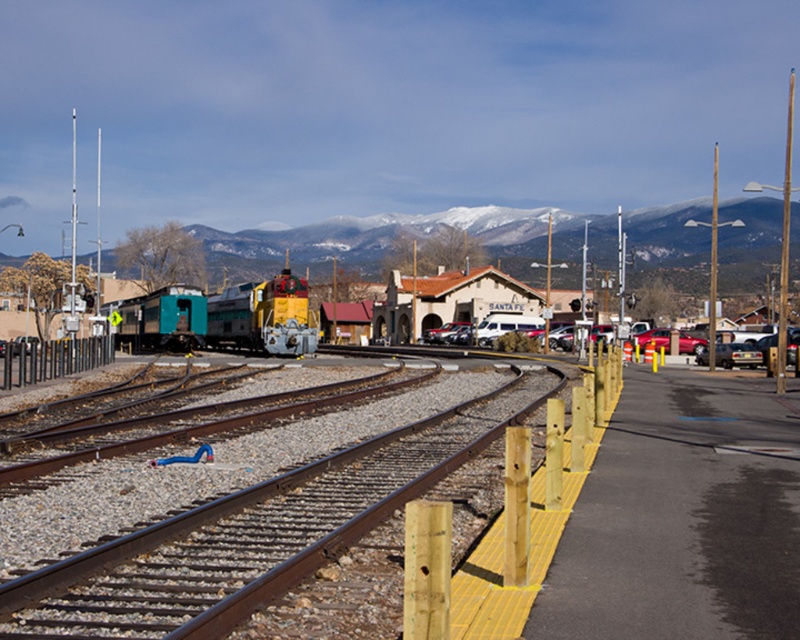
Does point (745, 280) lie behind point (700, 362)?

Yes, point (745, 280) is farther from viewer.

Who is taller, snowy mountain at upper center or metallic silver sedan at right?

With more height is snowy mountain at upper center.

What do you see at coordinates (380, 244) in the screenshot? I see `snowy mountain at upper center` at bounding box center [380, 244].

Identify the location of snowy mountain at upper center. This screenshot has height=640, width=800. point(380,244).

Can you confirm if snowy mountain at upper center is shorter than metallic silver car at center?

Incorrect, snowy mountain at upper center's height does not fall short of metallic silver car at center's.

Which is more to the right, snowy mountain at upper center or metallic silver car at center?

metallic silver car at center

Measure the distance between snowy mountain at upper center and camera.

snowy mountain at upper center and camera are 105.08 meters apart.

The image size is (800, 640). In order to click on snowy mountain at upper center in this screenshot , I will do (380, 244).

Between rusty metal train track at center and brown stucco railway station at center, which one appears on the right side from the viewer's perspective?

brown stucco railway station at center

Can you confirm if rusty metal train track at center is smaller than brown stucco railway station at center?

Correct, rusty metal train track at center occupies less space than brown stucco railway station at center.

What do you see at coordinates (252, 529) in the screenshot? I see `rusty metal train track at center` at bounding box center [252, 529].

Locate an element on the screen. The width and height of the screenshot is (800, 640). rusty metal train track at center is located at coordinates (252, 529).